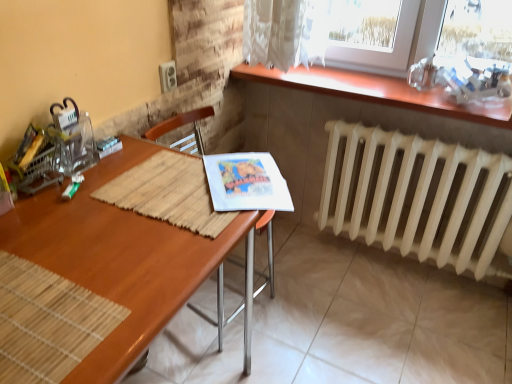
This screenshot has height=384, width=512. Find the location of `wooden table at upper right`. wooden table at upper right is located at coordinates (374, 91).

This screenshot has height=384, width=512. Describe the element at coordinates (417, 197) in the screenshot. I see `white matte radiator at lower right` at that location.

Where is `wooden table at upper right`? This screenshot has width=512, height=384. wooden table at upper right is located at coordinates (374, 91).

Image resolution: width=512 pixels, height=384 pixels. I want to click on desk that is in front of the wooden chair at center, so click(125, 259).

Is wooden desk at center at the back of wooden chair at center?

wooden chair at center does not have its back to wooden desk at center.

Is wooden chair at center taller or shorter than wooden table at upper right?

wooden chair at center is taller than wooden table at upper right.

From the image's perspective, is wooden chair at center above or below wooden table at upper right?

Clearly, from the image's perspective, wooden chair at center is below wooden table at upper right.

What's the angular difference between wooden chair at center and wooden table at upper right's facing directions?

wooden chair at center and wooden table at upper right are facing 85.9 degrees away from each other.

Which is in front, wooden chair at center or wooden table at upper right?

wooden chair at center is closer to the camera.

Looking at this image, is white matte radiator at lower right oriented away from wooden chair at center?

No, white matte radiator at lower right is not facing the opposite direction of wooden chair at center.

From a real-world perspective, is white matte radiator at lower right physically below wooden chair at center?

Yes, from a real-world perspective, white matte radiator at lower right is under wooden chair at center.

Does white matte radiator at lower right come behind wooden chair at center?

Yes, it is behind wooden chair at center.

Who is taller, white matte radiator at lower right or wooden chair at center?

Standing taller between the two is wooden chair at center.

Which object is positioned more to the right, wooden table at upper right or white matte radiator at lower right?

Positioned to the right is white matte radiator at lower right.

Between wooden table at upper right and white matte radiator at lower right, which one has smaller width?

Thinner between the two is white matte radiator at lower right.

Is wooden table at upper right facing away from white matte radiator at lower right?

No.

Considering the points (305, 79) and (384, 236), which point is behind, point (305, 79) or point (384, 236)?

Positioned behind is point (384, 236).

Is white matte radiator at lower right directly adjacent to wooden table at upper right?

No.

Is white matte radiator at lower right wider than wooden table at upper right?

No, white matte radiator at lower right is not wider than wooden table at upper right.

From a real-world perspective, is white matte radiator at lower right beneath wooden table at upper right?

Correct, in the physical world, white matte radiator at lower right is lower than wooden table at upper right.

Find the location of a particular element. The height and width of the screenshot is (384, 512). radiator below the wooden table at upper right (from the image's perspective) is located at coordinates (417, 197).

Between wooden desk at center and wooden chair at center, which one is positioned in front?

wooden desk at center is in front.

How many degrees apart are the facing directions of wooden desk at center and wooden chair at center?

wooden desk at center and wooden chair at center are facing 3.77 degrees away from each other.

Between wooden desk at center and wooden chair at center, which one has smaller size?

wooden chair at center is smaller.

Which of these two, wooden desk at center or wooden chair at center, stands shorter?

With less height is wooden desk at center.

Does point (130, 263) appear closer or farther from the camera than point (488, 115)?

Clearly, point (130, 263) is closer to the camera than point (488, 115).

This screenshot has width=512, height=384. I want to click on desk in front of the wooden table at upper right, so click(125, 259).

Considering the relative positions of wooden desk at center and wooden table at upper right in the image provided, is wooden desk at center to the left of wooden table at upper right from the viewer's perspective?

Yes.

You are a GUI agent. You are given a task and a screenshot of the screen. Output one action in this format:
    pyautogui.click(x=<x>, y=<y>)
    Task: Click on the desk directly beneath the wooden chair at center (from a real-world perspective)
    
    Given the screenshot: What is the action you would take?
    point(125,259)

Identify the location of armchair below the wooden table at upper right (from the image's perspective). (182, 126).

Estimate the real-world distances between objects in this image. Which object is further from wooden table at upper right, white matte radiator at lower right or wooden desk at center?

wooden desk at center.

Which object lies nearer to the anchor point white matte radiator at lower right, wooden table at upper right or wooden chair at center?

wooden table at upper right is closer to white matte radiator at lower right.

From the picture: Looking at the image, which one is located further to wooden chair at center, wooden desk at center or wooden table at upper right?

The object further to wooden chair at center is wooden desk at center.

Which object lies nearer to the anchor point wooden table at upper right, wooden desk at center or wooden chair at center?

The object closer to wooden table at upper right is wooden chair at center.

Considering their positions, is wooden table at upper right positioned further to wooden chair at center than white matte radiator at lower right?

wooden table at upper right.

From the image, which object appears to be nearer to white matte radiator at lower right, wooden chair at center or wooden desk at center?

wooden chair at center lies closer to white matte radiator at lower right than the other object.

Looking at the image, which one is located closer to white matte radiator at lower right, wooden desk at center or wooden chair at center?

wooden chair at center.

Based on their spatial positions, is wooden desk at center or white matte radiator at lower right closer to wooden table at upper right?

white matte radiator at lower right is closer to wooden table at upper right.

This screenshot has height=384, width=512. Identify the location of table between wooden desk at center and white matte radiator at lower right in the horizontal direction. (374, 91).

Locate an element on the screen. The image size is (512, 384). table between wooden chair at center and white matte radiator at lower right in the horizontal direction is located at coordinates (374, 91).

In order to click on armchair situated between wooden desk at center and white matte radiator at lower right from left to right in this screenshot , I will do `click(182, 126)`.

Image resolution: width=512 pixels, height=384 pixels. In order to click on armchair between wooden desk at center and wooden table at upper right along the z-axis in this screenshot , I will do `click(182, 126)`.